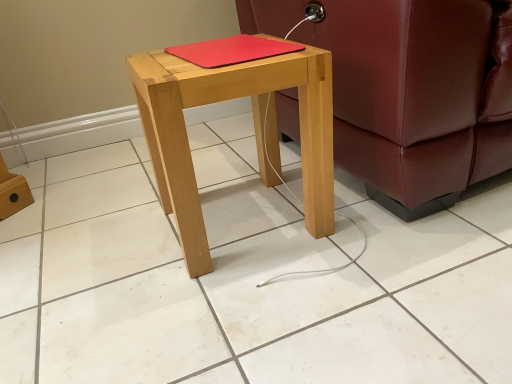
Question: Does point (507, 79) appear closer or farther from the camera than point (159, 102)?

Choices:
 (A) closer
 (B) farther

Answer: (B)

Question: From a real-world perspective, relative to natural wood stool at center, is leather couch at right vertically above or below?

Choices:
 (A) below
 (B) above

Answer: (B)

Question: Estimate the real-world distances between objects in this image. Which object is farther from the natural wood stool at center?

Choices:
 (A) red matte notebook at center
 (B) leather couch at right

Answer: (B)

Question: Which object is the farthest from the red matte notebook at center?

Choices:
 (A) leather couch at right
 (B) natural wood stool at center

Answer: (A)